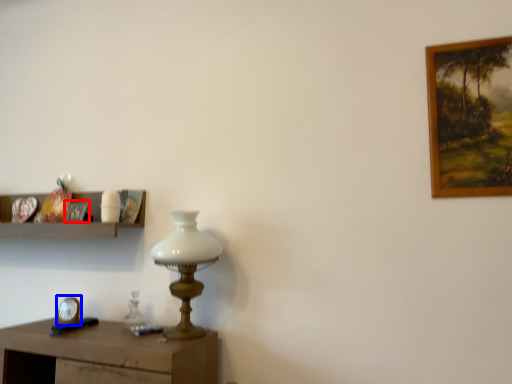
Question: Among these objects, which one is nearest to the camera, picture frame (highlighted by a red box) or clock (highlighted by a blue box)?

Choices:
 (A) picture frame
 (B) clock

Answer: (B)